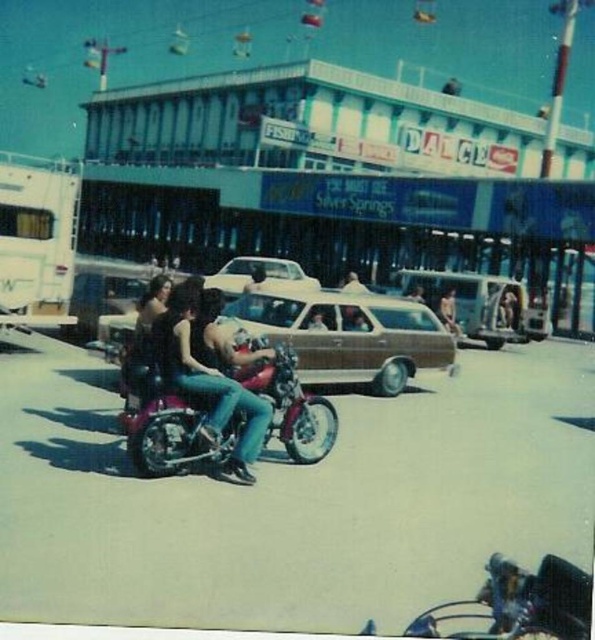
You are a photographer at the fairground. You want to capture a photo of the shiny chrome motorcycle at lower right and the denim jeans at center. Which object should you focus on first if you want to include both in the same frame without moving the camera?

The shiny chrome motorcycle at lower right is below denim jeans at center, so you should focus on the denim jeans at center first to ensure both are in the frame.

You are standing at the fairground near the large building with the sign that says DANCE. You see two points marked in the image. The first point is at coordinates point (x=311, y=358) and the second point is at point (x=406, y=627). Which point is closer to the large building with the sign that says DANCE?

Point (x=311, y=358) is behind point (x=406, y=627), so the point closer to the large building with the sign that says DANCE is point (x=406, y=627).